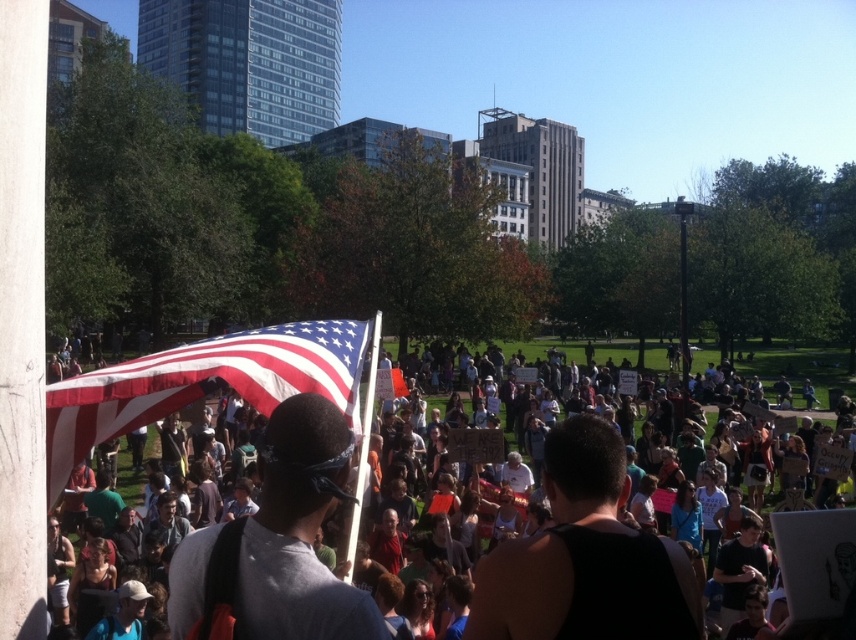
Does american flag at center lie in front of white tank top at center?

Yes, it is.

Is point (107, 384) farther from camera compared to point (705, 404)?

No.

Which is behind, point (348, 323) or point (676, 406)?

Point (676, 406)

The height and width of the screenshot is (640, 856). Find the location of `american flag at center`. american flag at center is located at coordinates (203, 384).